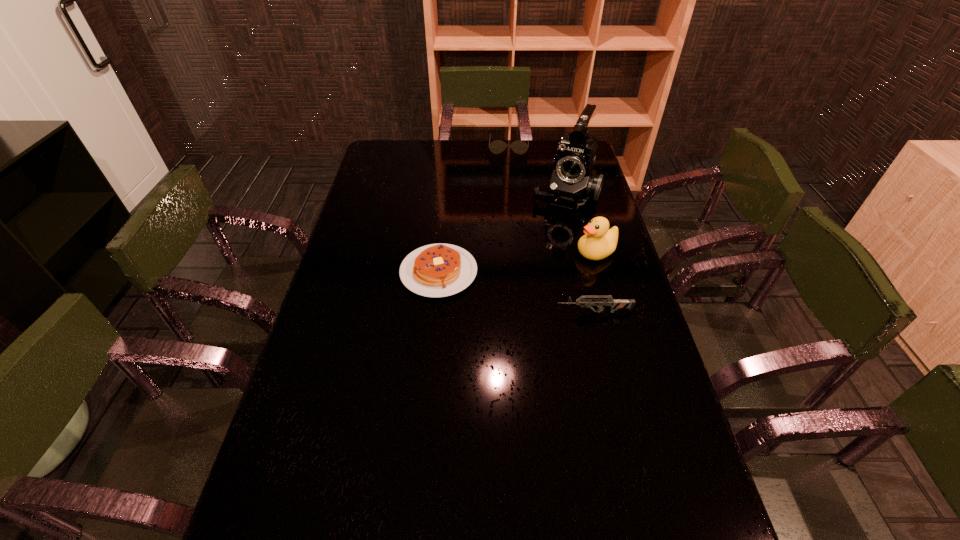
The height and width of the screenshot is (540, 960). What are the coordinates of `object that is at the far edge` in the screenshot? It's located at (520, 147).

Where is `gun at the right edge`? gun at the right edge is located at coordinates (615, 304).

Locate an element on the screen. This screenshot has width=960, height=540. duck that is at the right edge is located at coordinates (599, 241).

Image resolution: width=960 pixels, height=540 pixels. Identify the location of camcorder located in the right edge section of the desktop. (573, 181).

The height and width of the screenshot is (540, 960). In the image, there is a desktop. What are the coordinates of `free region at the far edge` in the screenshot? It's located at (476, 167).

You are a GUI agent. You are given a task and a screenshot of the screen. Output one action in this format:
    pyautogui.click(x=<x>, y=<y>)
    Task: Click on the vacant space at the left edge
    The height and width of the screenshot is (540, 960).
    Given the screenshot: What is the action you would take?
    pyautogui.click(x=348, y=239)

Where is `vacant space at the right edge of the desktop`? The image size is (960, 540). vacant space at the right edge of the desktop is located at coordinates (602, 342).

In the image, there is a desktop. Where is `free space at the far left corner`? free space at the far left corner is located at coordinates (374, 156).

I want to click on free space at the near left corner of the desktop, so click(x=307, y=496).

Find the location of a particular element. vacant point located between the shortest object and the nearest object is located at coordinates (516, 292).